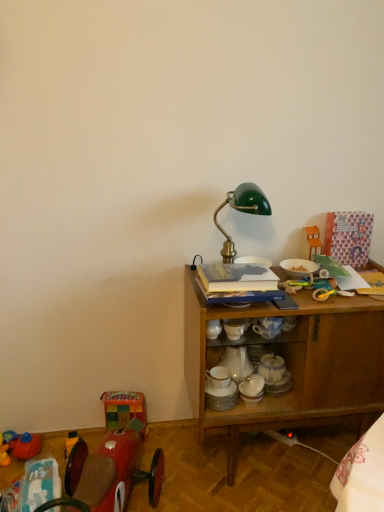
This screenshot has height=512, width=384. Identify the location of vacant area located to the right-hand side of multicolored fabric cube at lower left, the second toy viewed from the right. (x=168, y=447).